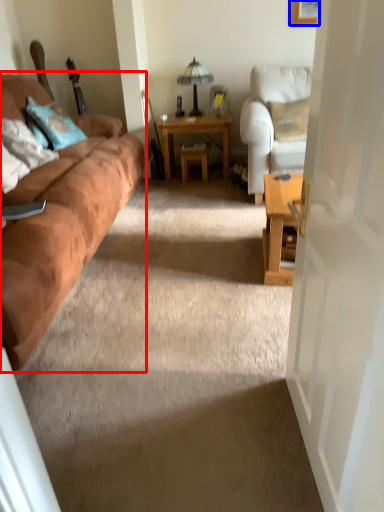
Question: Which object is further to the camera taking this photo, studio couch (highlighted by a red box) or picture frame (highlighted by a blue box)?

Choices:
 (A) studio couch
 (B) picture frame

Answer: (B)